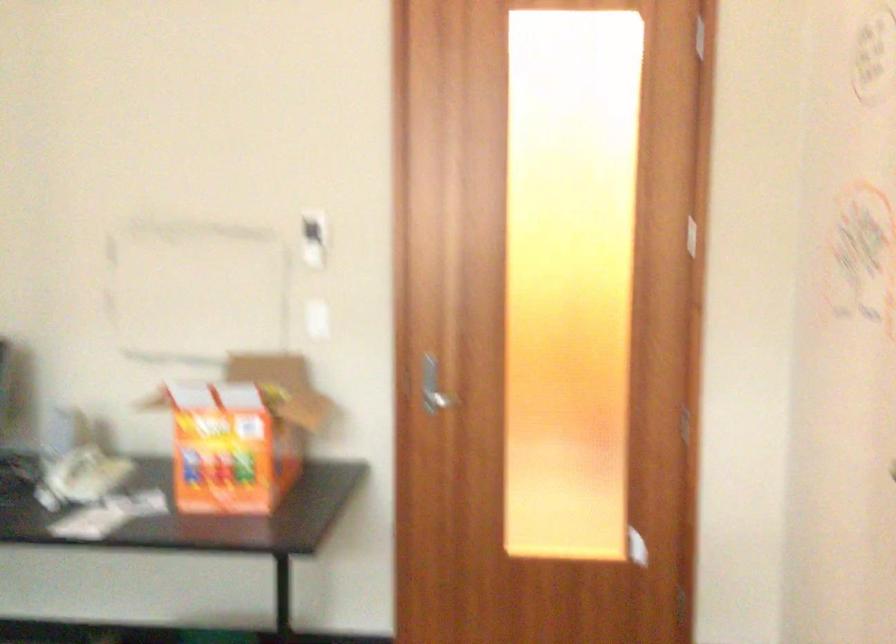
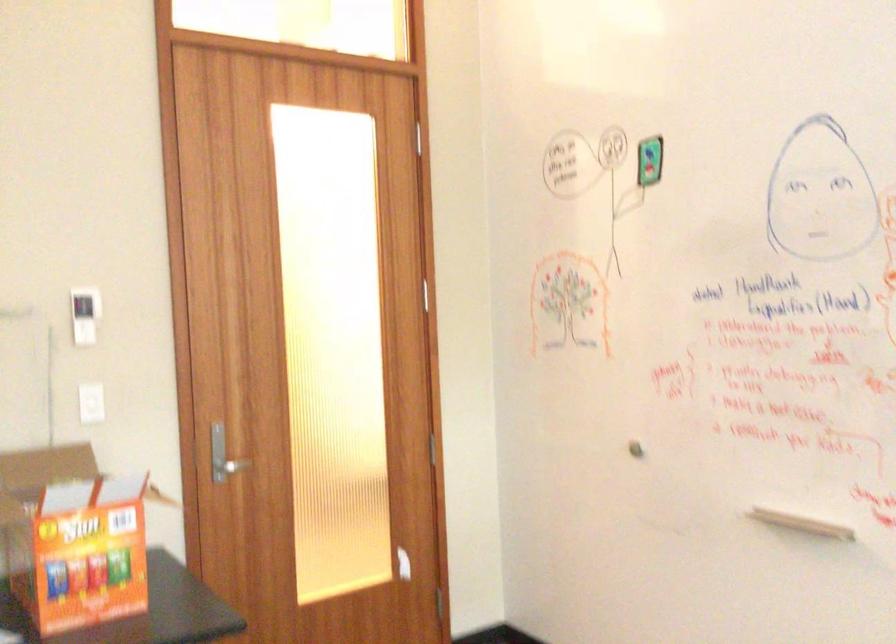
The point at (431,399) is marked in the first image. Where is the corresponding point in the second image?

(226, 466)